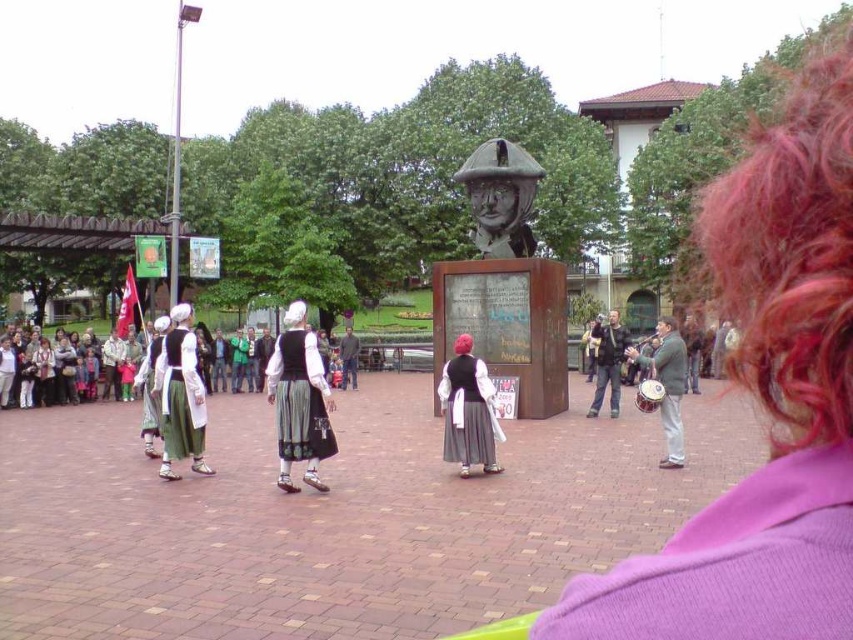
You are standing in the park and see the green fabric skirt at left. Where exactly is it located in the image?

The green fabric skirt at left is located at point (180, 396) in the image.

You are an event planner setting up for a performance in the park. You have a black velvet dress at center and a green fabric drum at right. Which item takes up more space?

The green fabric drum at right takes up more space because it is larger than the black velvet dress at center.